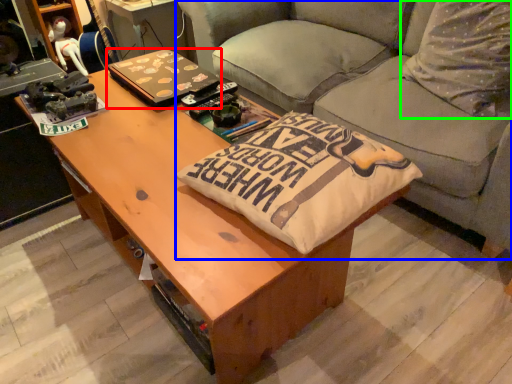
Question: Which object is the farthest from laptop (highlighted by a red box)? Choose among these: studio couch (highlighted by a blue box) or throw pillow (highlighted by a green box).

Choices:
 (A) studio couch
 (B) throw pillow

Answer: (B)